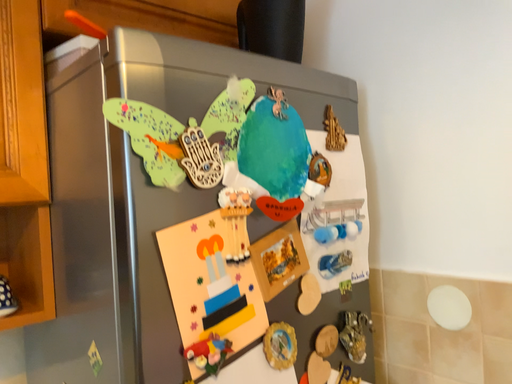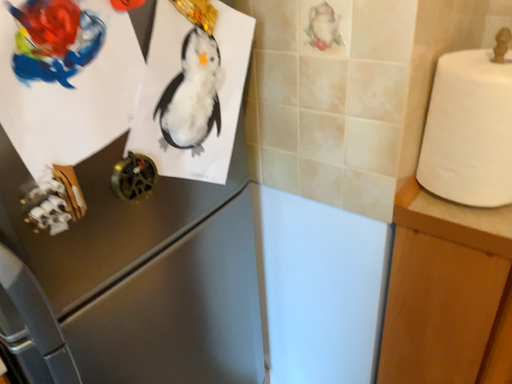
Question: How did the camera likely rotate when shooting the video?

Choices:
 (A) rotated left
 (B) rotated right

Answer: (B)